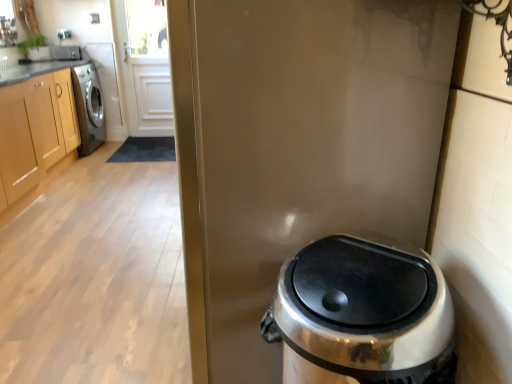
Question: Considering the positions of glossy metallic screen door at center and satin silver trash can at lower right in the image, is glossy metallic screen door at center bigger or smaller than satin silver trash can at lower right?

Choices:
 (A) big
 (B) small

Answer: (A)

Question: From a real-world perspective, is glossy metallic screen door at center positioned above or below satin silver trash can at lower right?

Choices:
 (A) above
 (B) below

Answer: (A)

Question: Estimate the real-world distances between objects in this image. Which object is farther from the satin silver trash can at lower right?

Choices:
 (A) light brown wood cabinets at left
 (B) glossy metallic screen door at center

Answer: (A)

Question: Estimate the real-world distances between objects in this image. Which object is closer to the glossy metallic screen door at center?

Choices:
 (A) satin silver trash can at lower right
 (B) light brown wood cabinets at left

Answer: (A)